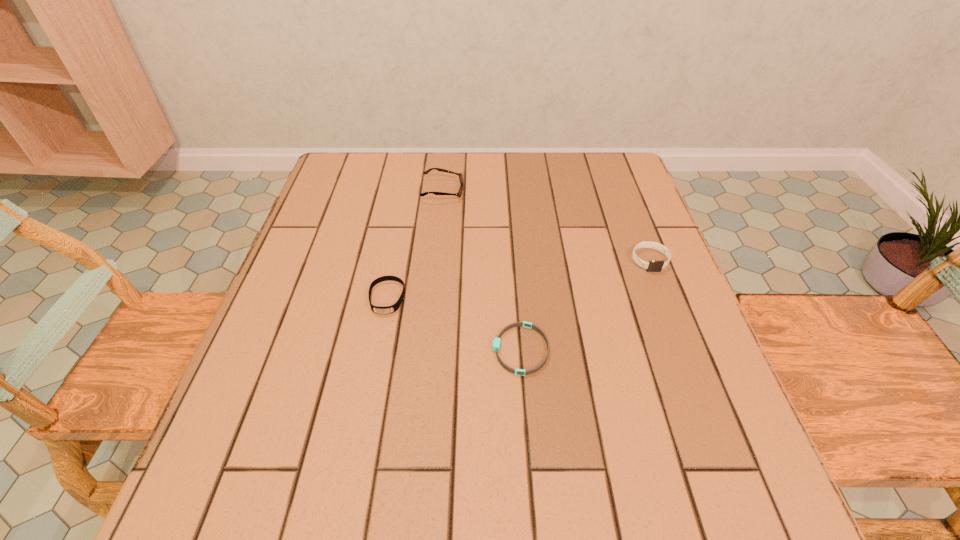
Identify the location of free region located 0.060m on the display of the second shortest object. The width and height of the screenshot is (960, 540). (379, 340).

This screenshot has height=540, width=960. I want to click on free space located 0.310m on the buckle of the second wristband from right to left, so click(327, 349).

Image resolution: width=960 pixels, height=540 pixels. Find the location of `vacant space located on the buckle of the second wristband from right to left`. vacant space located on the buckle of the second wristband from right to left is located at coordinates 338,349.

In order to click on free region located 0.370m on the buckle of the second wristband from right to left in this screenshot , I will do tap(296, 349).

Find the location of `object located at the far edge`. object located at the far edge is located at coordinates (460, 175).

The height and width of the screenshot is (540, 960). In order to click on object located at the right edge in this screenshot , I will do `click(653, 266)`.

In the image, there is a desktop. What are the coordinates of `vacant space at the far edge` in the screenshot? It's located at (423, 177).

The image size is (960, 540). Identify the location of vacant space at the near edge. (431, 504).

This screenshot has height=540, width=960. In order to click on free location at the left edge of the desktop in this screenshot , I will do `click(325, 341)`.

This screenshot has height=540, width=960. In the image, there is a desktop. In order to click on vacant space at the right edge in this screenshot , I will do `click(688, 313)`.